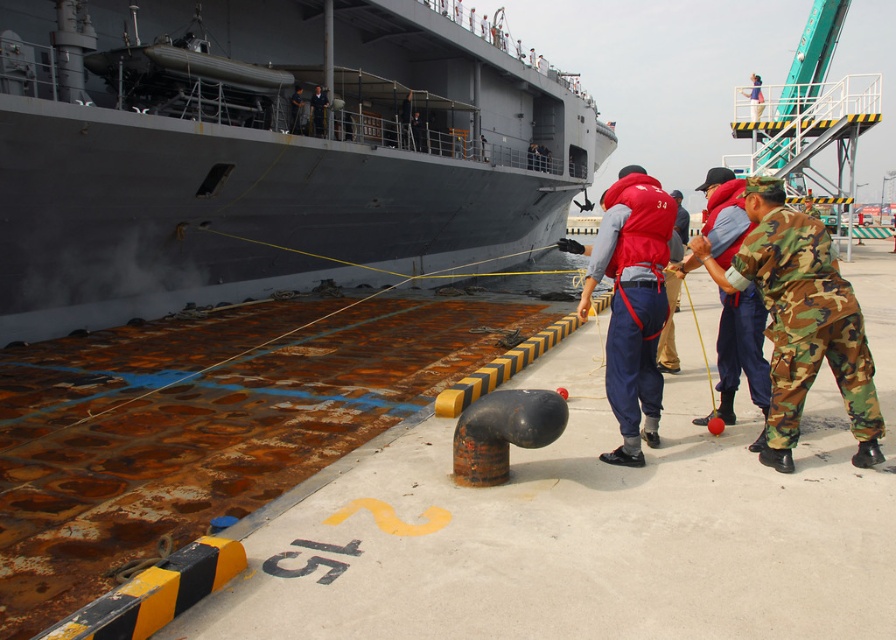
Question: Which is farther from the gray matte ship at upper left?

Choices:
 (A) red fabric life vest at center
 (B) camo fabric soldier at lower right

Answer: (A)

Question: Which point is closer to the camera?

Choices:
 (A) (765, 332)
 (B) (195, 275)

Answer: (A)

Question: Is gray matte ship at upper left positioned at the back of camo fabric soldier at lower right?

Choices:
 (A) yes
 (B) no

Answer: (A)

Question: Does gray matte ship at upper left have a larger size compared to red fabric life vest at center?

Choices:
 (A) yes
 (B) no

Answer: (A)

Question: Is camo fabric soldier at lower right smaller than red fabric life vest at center?

Choices:
 (A) yes
 (B) no

Answer: (B)

Question: Which of the following is the farthest from the observer?

Choices:
 (A) (144, 99)
 (B) (808, 368)
 (C) (652, 321)

Answer: (A)